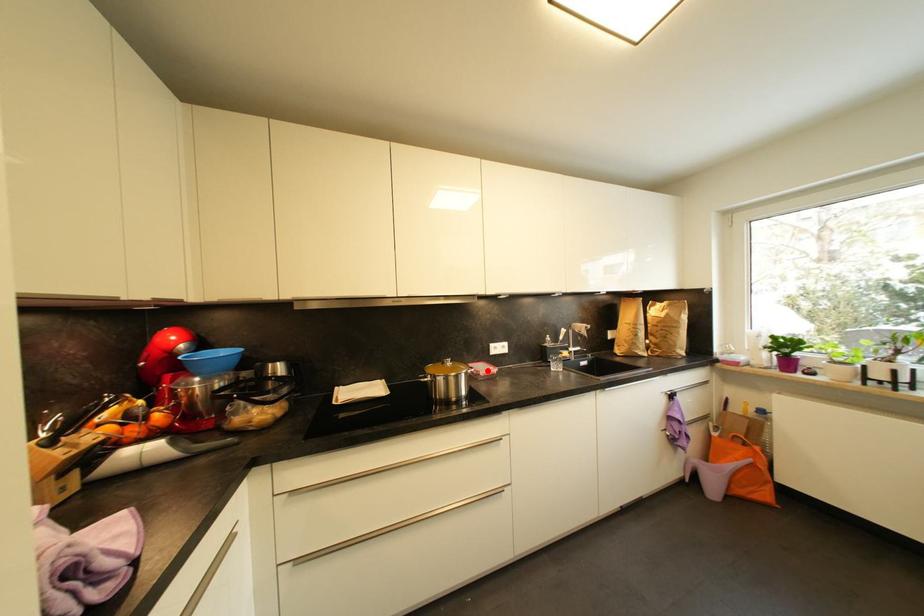
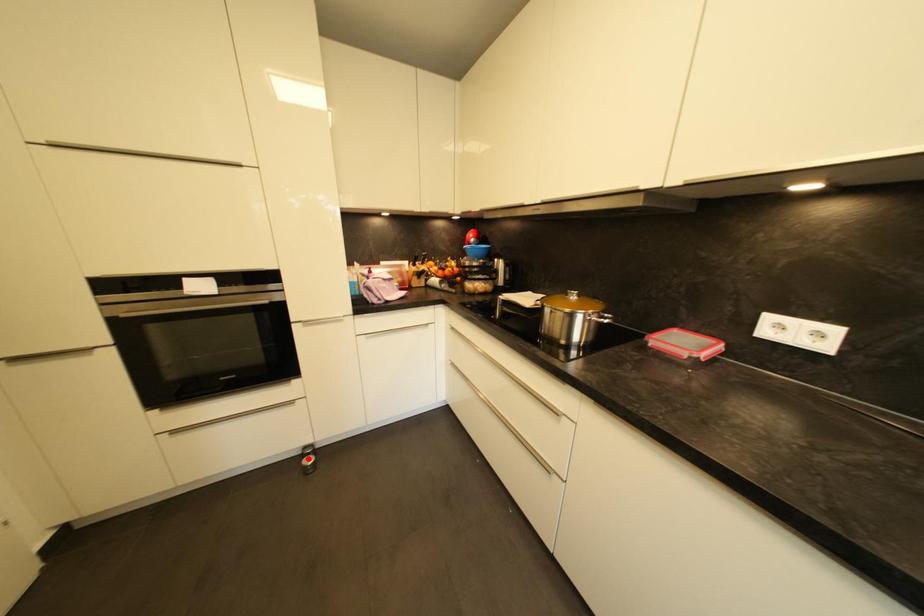
I am providing you with two images of the same scene from different viewpoints. A red point is marked on the first image and another point is marked on the second image. Is the red point in image1 aligned with the point shown in image2?

No